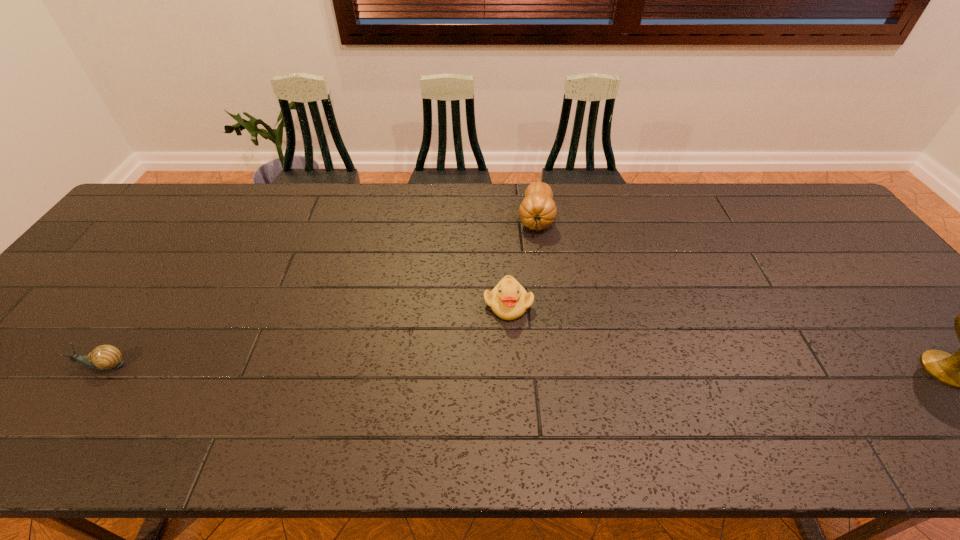
Identify the location of free space located on the stem side of the gourd. The width and height of the screenshot is (960, 540). (531, 317).

In order to click on vacant space located 0.120m on the stem side of the gourd in this screenshot , I will do `click(534, 269)`.

Identify the location of vacant space situated 0.160m on the front-facing side of the duckling. (544, 374).

The width and height of the screenshot is (960, 540). Find the location of `vacant space located on the front-facing side of the duckling`. vacant space located on the front-facing side of the duckling is located at coordinates (537, 360).

This screenshot has height=540, width=960. Identify the location of vacant region located on the front-facing side of the duckling. (542, 370).

Locate an element on the screen. object that is positioned at the far edge is located at coordinates (537, 211).

What are the coordinates of `object at the near edge` in the screenshot? It's located at (105, 357).

In the image, there is a desktop. Where is `vacant area at the far edge`? The height and width of the screenshot is (540, 960). vacant area at the far edge is located at coordinates (565, 191).

This screenshot has width=960, height=540. Identify the location of vacant region at the near edge. (173, 392).

This screenshot has width=960, height=540. I want to click on vacant region at the left edge of the desktop, so click(39, 357).